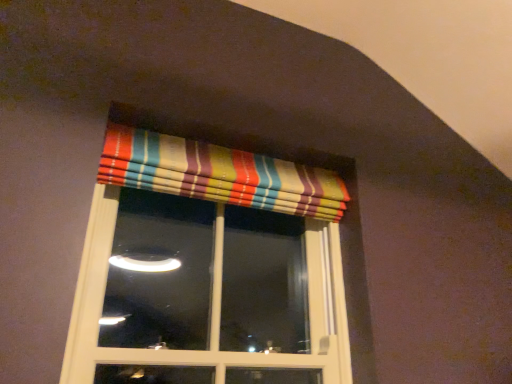
Question: From a real-world perspective, is striped fabric curtain at upper center on striped fabric valance at upper center?

Choices:
 (A) yes
 (B) no

Answer: (A)

Question: Is the surface of striped fabric curtain at upper center in direct contact with striped fabric valance at upper center?

Choices:
 (A) yes
 (B) no

Answer: (B)

Question: Is striped fabric curtain at upper center oriented towards striped fabric valance at upper center?

Choices:
 (A) no
 (B) yes

Answer: (A)

Question: Is striped fabric curtain at upper center positioned before striped fabric valance at upper center?

Choices:
 (A) no
 (B) yes

Answer: (A)

Question: Is striped fabric curtain at upper center further to camera compared to striped fabric valance at upper center?

Choices:
 (A) yes
 (B) no

Answer: (A)

Question: Is striped fabric valance at upper center a part of striped fabric curtain at upper center?

Choices:
 (A) no
 (B) yes

Answer: (A)

Question: Is striped fabric valance at upper center aimed at striped fabric curtain at upper center?

Choices:
 (A) yes
 (B) no

Answer: (A)

Question: Is striped fabric valance at upper center with striped fabric curtain at upper center?

Choices:
 (A) no
 (B) yes

Answer: (A)

Question: Is striped fabric curtain at upper center at the back of striped fabric valance at upper center?

Choices:
 (A) no
 (B) yes

Answer: (B)

Question: Does striped fabric valance at upper center have a greater height compared to striped fabric curtain at upper center?

Choices:
 (A) yes
 (B) no

Answer: (A)

Question: Considering the relative positions of striped fabric valance at upper center and striped fabric curtain at upper center in the image provided, is striped fabric valance at upper center to the left of striped fabric curtain at upper center from the viewer's perspective?

Choices:
 (A) no
 (B) yes

Answer: (B)

Question: Does striped fabric valance at upper center have a smaller size compared to striped fabric curtain at upper center?

Choices:
 (A) yes
 (B) no

Answer: (B)

Question: In terms of width, does striped fabric curtain at upper center look wider or thinner when compared to striped fabric valance at upper center?

Choices:
 (A) wide
 (B) thin

Answer: (B)